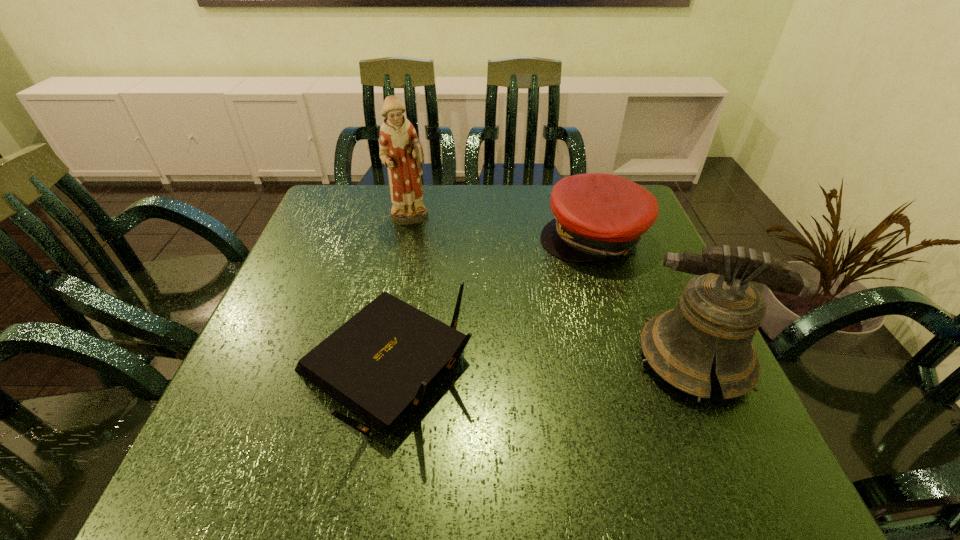
The height and width of the screenshot is (540, 960). What are the coordinates of `vacant space positioned on the front-facing side of the tallest object` in the screenshot? It's located at (476, 330).

The image size is (960, 540). I want to click on vacant region located 0.270m on the front-facing side of the tallest object, so click(x=455, y=293).

Locate an element on the screen. cap positioned at the far edge is located at coordinates (596, 215).

Find the location of a particular element. figurine present at the far edge is located at coordinates (401, 152).

Identify the location of router that is at the near edge. (380, 360).

This screenshot has width=960, height=540. Find the location of `bell situated at the near edge`. bell situated at the near edge is located at coordinates (719, 312).

Locate an element on the screen. object that is at the left edge is located at coordinates (380, 360).

Image resolution: width=960 pixels, height=540 pixels. Identify the location of bell at the right edge. tap(719, 312).

The height and width of the screenshot is (540, 960). I want to click on cap present at the right edge, so click(596, 215).

The image size is (960, 540). In order to click on object located at the near left corner in this screenshot , I will do `click(380, 360)`.